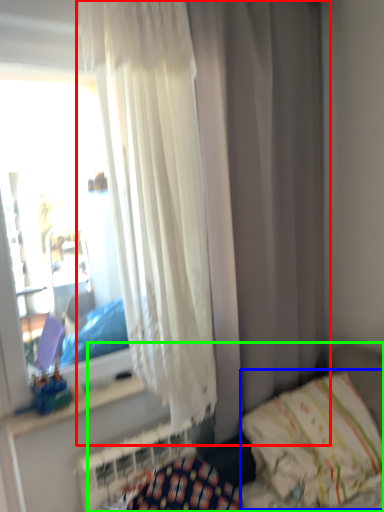
Question: Which object is the farthest from curtain (highlighted by a red box)? Choose among these: pillow (highlighted by a blue box) or hospital bed (highlighted by a green box).

Choices:
 (A) pillow
 (B) hospital bed

Answer: (B)